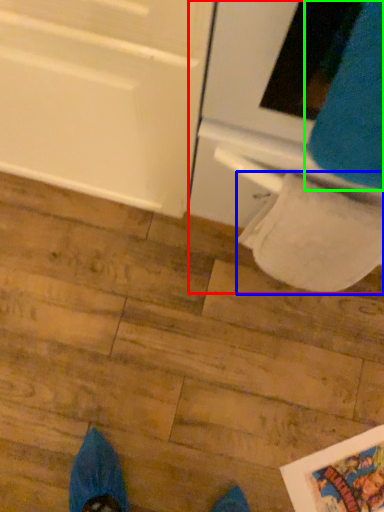
Question: Based on their relative distances, which object is farther from oven (highlighted by a red box)? Choose from toilet paper (highlighted by a blue box) and sweat pant (highlighted by a green box).

Choices:
 (A) toilet paper
 (B) sweat pant

Answer: (B)